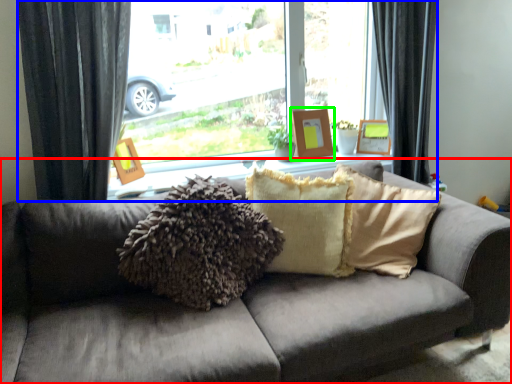
Question: Considering the real-world distances, which object is closest to studio couch (highlighted by a red box)? window (highlighted by a blue box) or picture frame (highlighted by a green box).

Choices:
 (A) window
 (B) picture frame

Answer: (A)